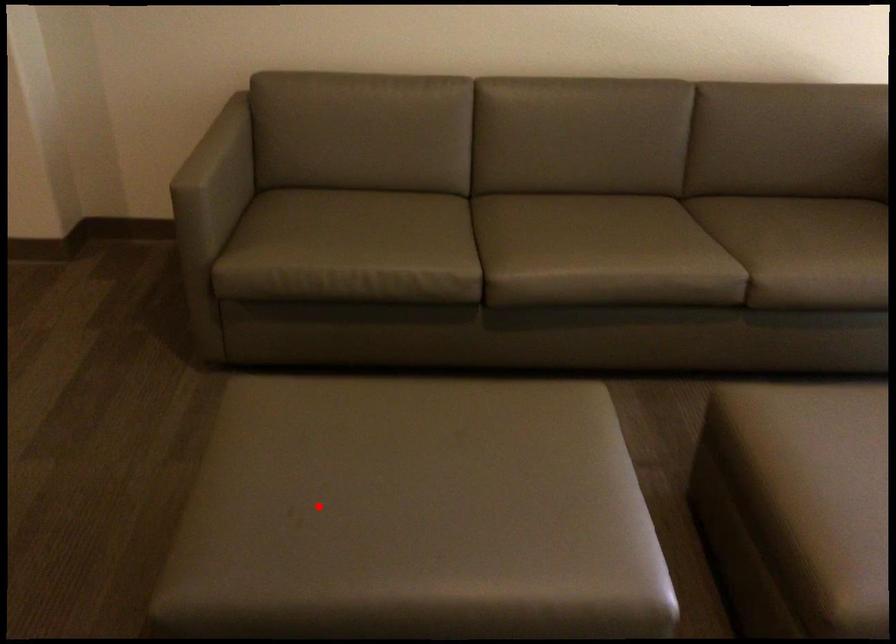
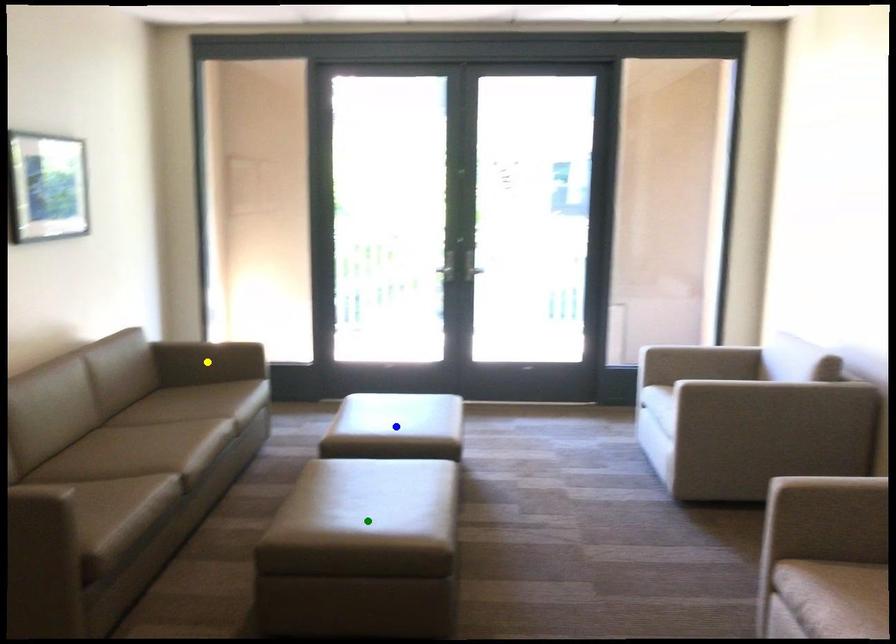
Question: I am providing you with two images of the same scene from different viewpoints. A red point is marked on the first image. You are given multiple points on the second image. Which point in image 2 is actually the same real-world point as the red point in image 1?

Choices:
 (A) yellow point
 (B) blue point
 (C) green point

Answer: (C)